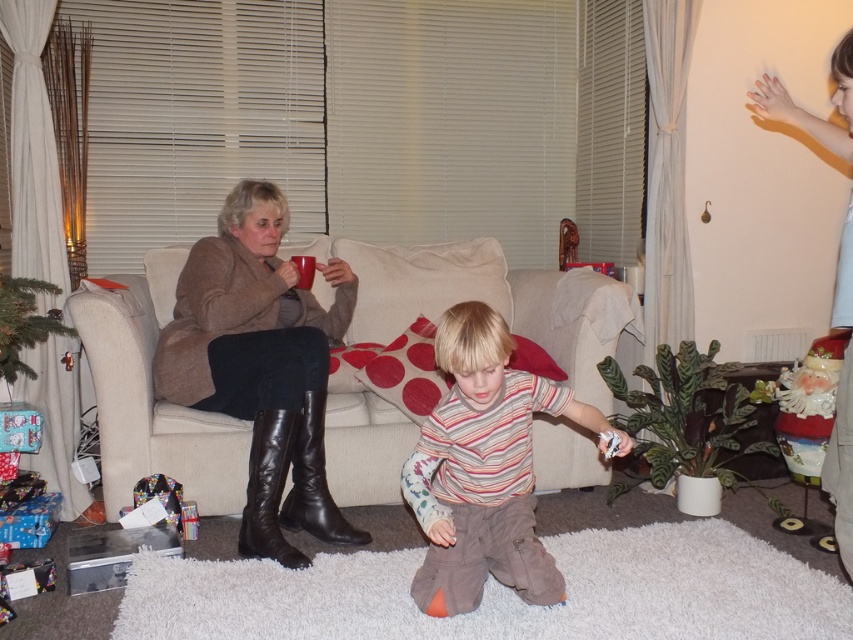
Looking at this image, you are standing in the living room and want to reach a point that is exactly at coordinates point [241,541]. If you are currently 2 meters away from this point, how much further do you need to move forward to reach it?

The distance of point [241,541] from viewer is 2.37 meters. Since you are currently 2 meters away, you need to move forward an additional 0.37 meters to reach the point.

You are a guest entering the living room and want to sit on the beige fabric couch at center. However, the leather boots at left are blocking the path. Can you move the boots to access the couch?

The leather boots at left are behind the beige fabric couch at center, so you cannot reach them without moving the couch first. Therefore, you cannot move the boots to access the couch.